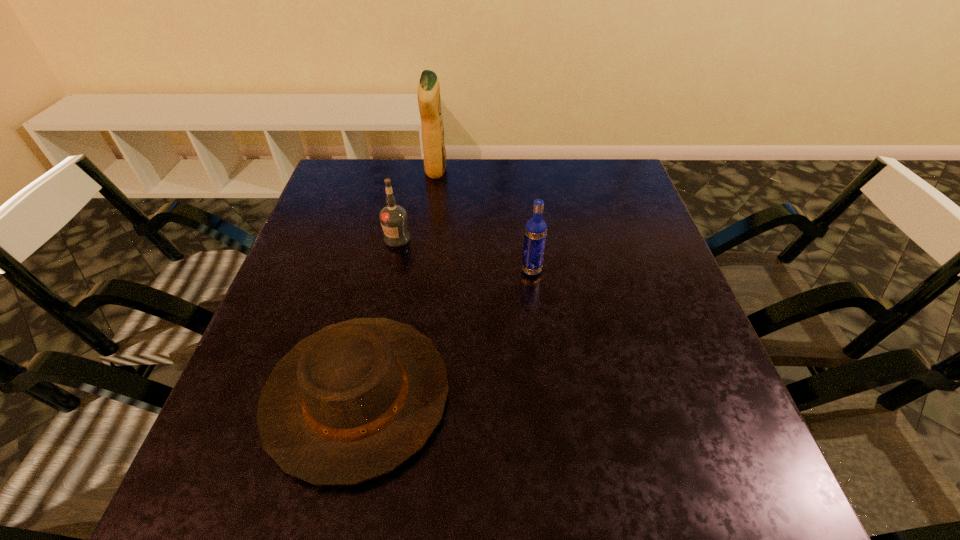
You are a GUI agent. You are given a task and a screenshot of the screen. Output one action in this format:
    pyautogui.click(x=<x>, y=<y>)
    Task: Click on the free space at the far left corner
    The image size is (960, 540).
    Given the screenshot: What is the action you would take?
    pyautogui.click(x=365, y=166)

This screenshot has height=540, width=960. What are the coordinates of `vacant area at the far right corner` in the screenshot? It's located at (577, 181).

Where is `blank space at the near right corner of the desktop`? The image size is (960, 540). blank space at the near right corner of the desktop is located at coordinates (748, 485).

The height and width of the screenshot is (540, 960). Find the location of `free space between the nearer vodka and the detergent`. free space between the nearer vodka and the detergent is located at coordinates (484, 220).

Where is `unoccupied area between the nearer vodka and the left vodka`? unoccupied area between the nearer vodka and the left vodka is located at coordinates (465, 254).

Find the location of a particular element. This screenshot has height=540, width=960. empty space between the left vodka and the cowboy hat is located at coordinates (377, 317).

Where is `vacant area between the second nearest object and the third nearest object`? This screenshot has height=540, width=960. vacant area between the second nearest object and the third nearest object is located at coordinates (465, 254).

The image size is (960, 540). What are the coordinates of `empty space that is in between the farthest object and the nearer vodka` in the screenshot? It's located at (484, 220).

This screenshot has height=540, width=960. I want to click on vacant space that's between the shortest object and the third farthest object, so click(444, 333).

I want to click on free space that is in between the cowboy hat and the rightmost object, so click(x=444, y=333).